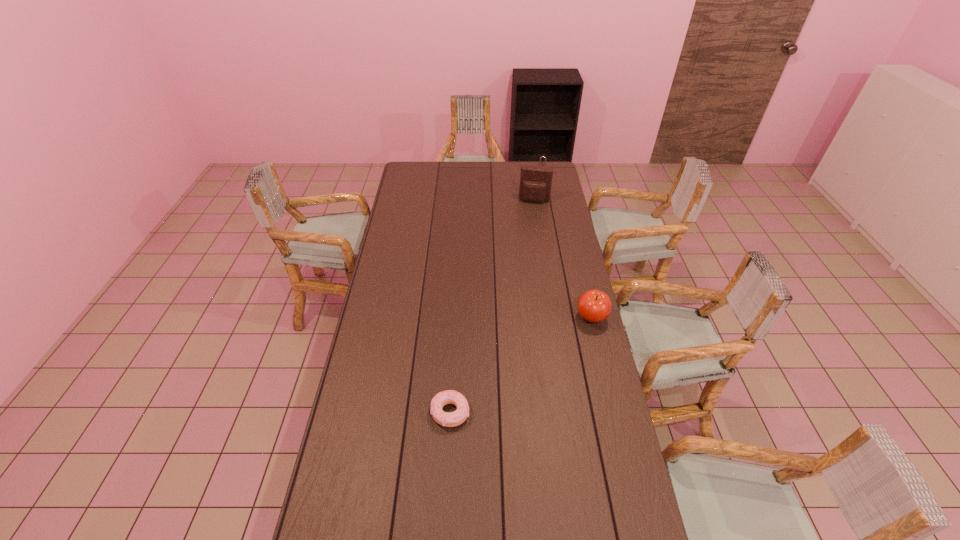
I want to click on vacant space on the desktop that is between the nearest object and the third farthest object and is positioned on the shackle of the padlock, so click(532, 357).

This screenshot has height=540, width=960. I want to click on vacant space on the desktop that is between the doughnut and the second nearest object and is positioned with an open flap on the second farthest object, so click(506, 375).